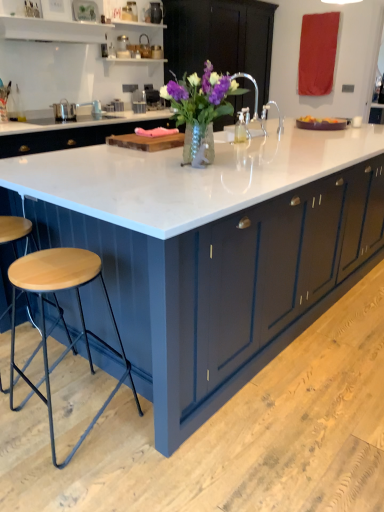
Locate an element on the screen. The image size is (384, 512). vacant space underneath translucent glass vase with purple flowers at center (from a real-world perspective) is located at coordinates (209, 165).